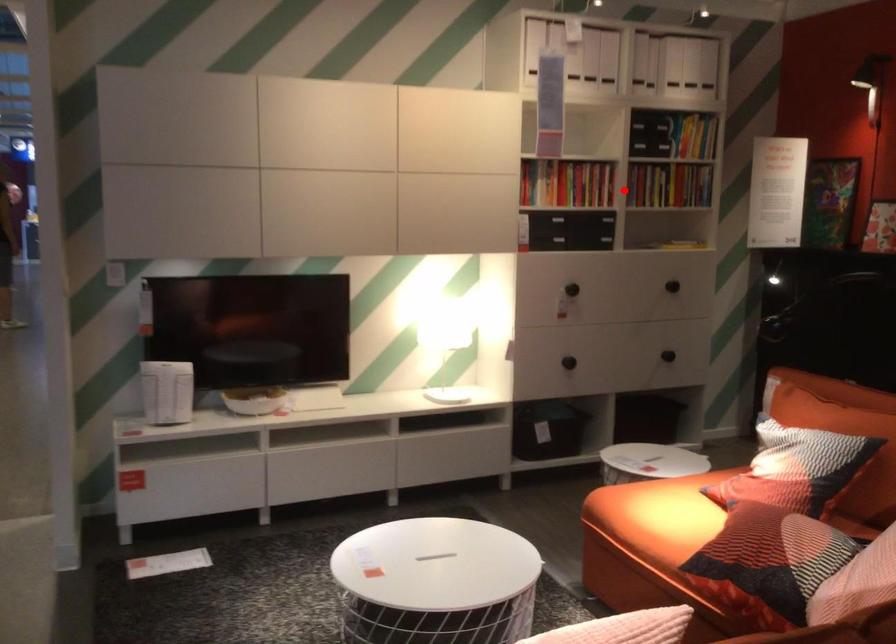
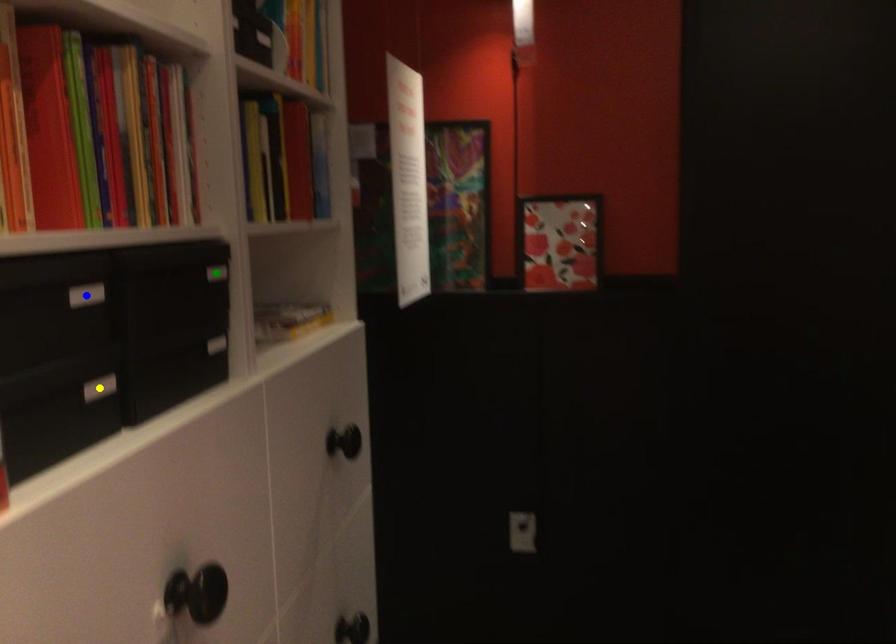
Question: I am providing you with two images of the same scene from different viewpoints. A red point is marked on the first image. You are given multiple points on the second image. Which point in image 2 represents the same 3d spot as the red point in image 1?

Choices:
 (A) yellow point
 (B) green point
 (C) blue point

Answer: (B)